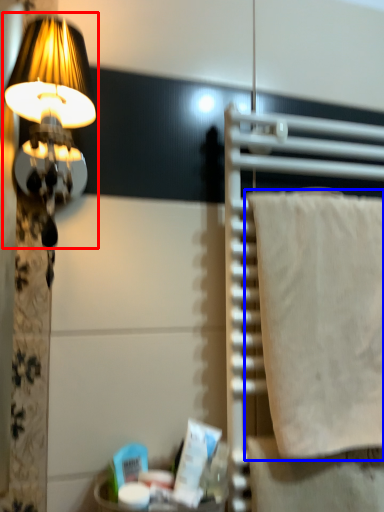
Question: Which object appears closest to the camera in this image, lamp (highlighted by a red box) or wrap (highlighted by a blue box)?

Choices:
 (A) lamp
 (B) wrap

Answer: (A)